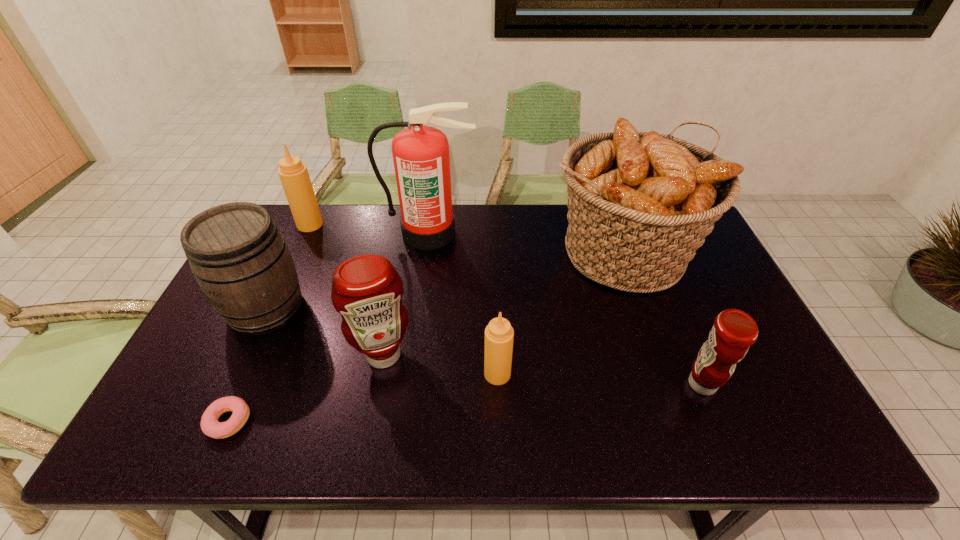
Image resolution: width=960 pixels, height=540 pixels. I want to click on the tallest object, so click(x=421, y=158).

This screenshot has width=960, height=540. Identify the location of red fire extinguisher. (421, 158).

Identify the location of the second tallest object. The height and width of the screenshot is (540, 960). (640, 204).

Image resolution: width=960 pixels, height=540 pixels. In order to click on the bigger tan condiment in this screenshot , I will do `click(294, 176)`.

This screenshot has height=540, width=960. What are the coordinates of `the farthest condiment` in the screenshot? It's located at (294, 176).

I want to click on the third condiment from right to left, so click(366, 290).

Image resolution: width=960 pixels, height=540 pixels. Identify the location of the bigger red condiment. (366, 290).

The image size is (960, 540). I want to click on wine bucket, so tap(240, 260).

The width and height of the screenshot is (960, 540). Find the location of `the smaller red condiment`. the smaller red condiment is located at coordinates (734, 331).

Image resolution: width=960 pixels, height=540 pixels. I want to click on the rightmost condiment, so click(734, 331).